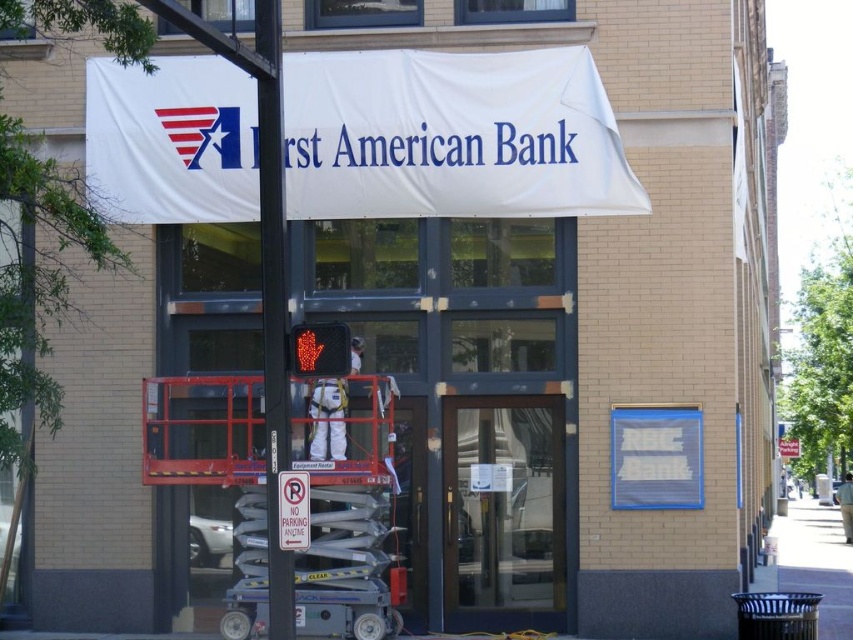
Which is above, clear glass door at center or metallic pole at center?

Positioned higher is metallic pole at center.

Is clear glass door at center to the right of metallic pole at center from the viewer's perspective?

Correct, you'll find clear glass door at center to the right of metallic pole at center.

Locate an element on the screen. The image size is (853, 640). clear glass door at center is located at coordinates (460, 403).

Who is more forward, (412,468) or (380,72)?

Point (380,72) is in front.

Is the position of clear glass door at center more distant than that of white fabric banner at upper center?

Yes, it is behind white fabric banner at upper center.

Between point (480, 381) and point (161, 145), which one is positioned behind?

The point (161, 145) is more distant.

In order to click on clear glass door at center in this screenshot , I will do `click(460, 403)`.

Is clear glass door at center to the left of white paper sign at lower center from the viewer's perspective?

Incorrect, clear glass door at center is not on the left side of white paper sign at lower center.

Which is in front, point (538, 451) or point (282, 536)?

Point (282, 536)

You are a GUI agent. You are given a task and a screenshot of the screen. Output one action in this format:
    pyautogui.click(x=<x>, y=<y>)
    Task: Click on the clear glass door at center
    
    Given the screenshot: What is the action you would take?
    pyautogui.click(x=460, y=403)